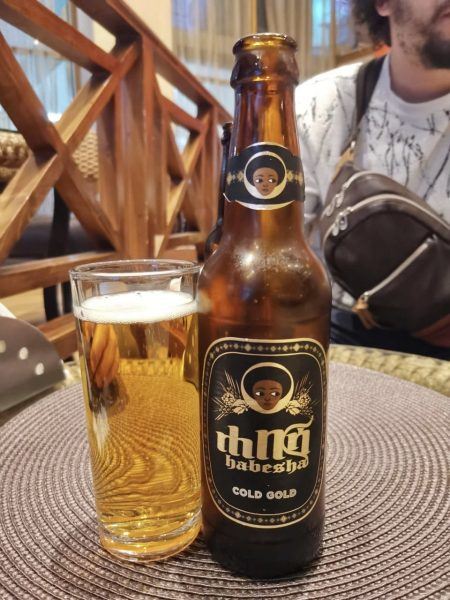
In order to click on table in this screenshot , I will do `click(440, 374)`.